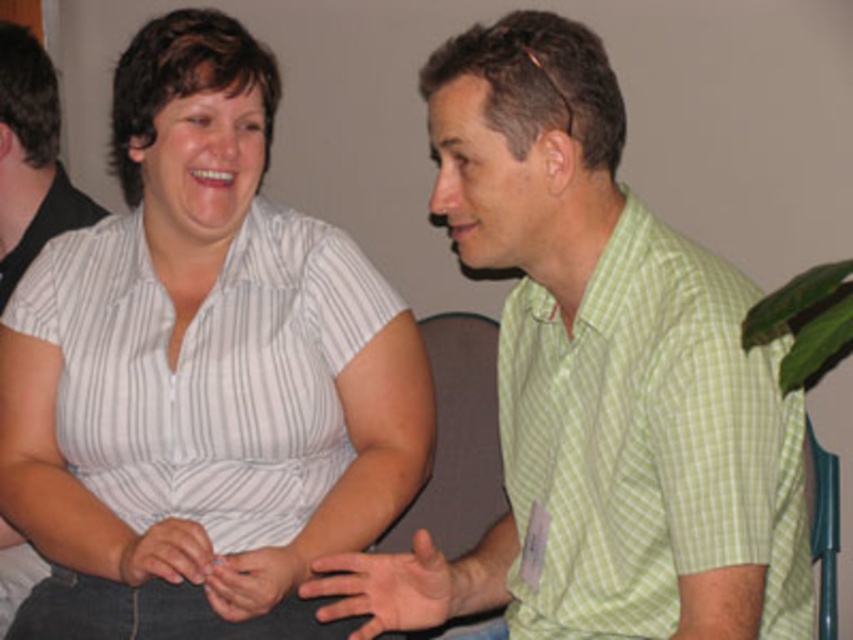
You are standing in the room where the two people are talking. You want to point to the exact location of the point at coordinates (206, 353). Which object should you point to?

The point at coordinates (206, 353) is on the white striped shirt at center, so you should point to the white striped shirt at center.

You are trying to decide which shirt to wear for a casual event. You have the green checkered shirt at center and the white striped shirt at center. Which one is smaller in size?

The green checkered shirt at center has a smaller size compared to the white striped shirt at center.

You are a photographer standing at a safe distance of 40 inches from the subject. You want to take a closeup photo of the green checkered shirt at center. Based on the scene description, can you successfully capture the subject without moving closer?

The distance of green checkered shirt at center from camera is 39.31 inches, which is just under your safe distance of 40 inches. Therefore, you can successfully capture the subject without moving closer.